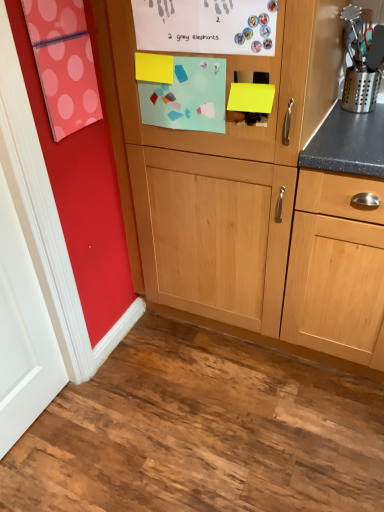
Question: Should I look upward or downward to see wooden cabinet at center?

Choices:
 (A) up
 (B) down

Answer: (A)

Question: Is white matte door at left in contact with wooden cabinet at center?

Choices:
 (A) yes
 (B) no

Answer: (B)

Question: Is white matte door at left closer to the viewer compared to wooden cabinet at center?

Choices:
 (A) no
 (B) yes

Answer: (B)

Question: Considering the relative sizes of white matte door at left and wooden cabinet at center in the image provided, is white matte door at left taller than wooden cabinet at center?

Choices:
 (A) no
 (B) yes

Answer: (A)

Question: From a real-world perspective, is white matte door at left over wooden cabinet at center?

Choices:
 (A) yes
 (B) no

Answer: (B)

Question: Considering the relative positions of white matte door at left and wooden cabinet at center in the image provided, is white matte door at left to the left of wooden cabinet at center from the viewer's perspective?

Choices:
 (A) yes
 (B) no

Answer: (A)

Question: Is white matte door at left oriented away from wooden cabinet at center?

Choices:
 (A) no
 (B) yes

Answer: (A)

Question: Does wooden cabinet at center come in front of white matte door at left?

Choices:
 (A) no
 (B) yes

Answer: (A)

Question: Is wooden cabinet at center thinner than white matte door at left?

Choices:
 (A) yes
 (B) no

Answer: (B)

Question: Is wooden cabinet at center beside white matte door at left?

Choices:
 (A) no
 (B) yes

Answer: (A)

Question: Is wooden cabinet at center bigger than white matte door at left?

Choices:
 (A) no
 (B) yes

Answer: (B)

Question: From a real-world perspective, is wooden cabinet at center positioned over white matte door at left based on gravity?

Choices:
 (A) no
 (B) yes

Answer: (B)

Question: Is wooden cabinet at center turned away from white matte door at left?

Choices:
 (A) yes
 (B) no

Answer: (B)

Question: From the image's perspective, is wooden cabinet at center positioned above or below white matte door at left?

Choices:
 (A) above
 (B) below

Answer: (A)